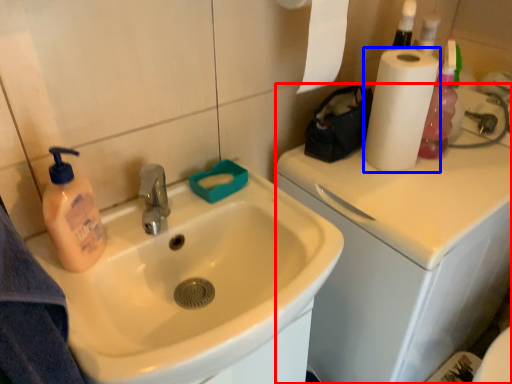
Question: Among these objects, which one is nearest to the camera, counter top (highlighted by a red box) or paper towel (highlighted by a blue box)?

Choices:
 (A) counter top
 (B) paper towel

Answer: (A)